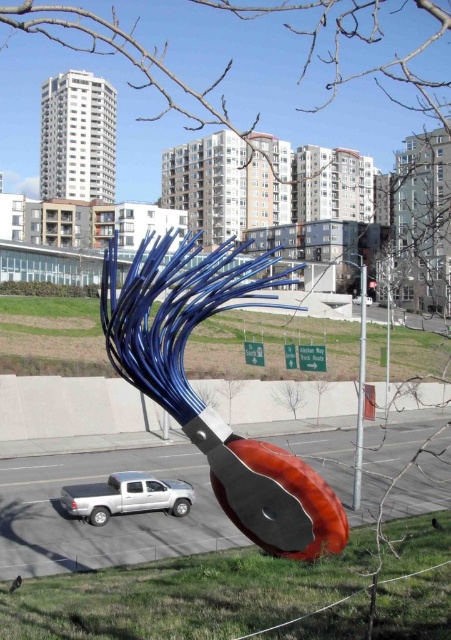
Which is below, silver metallic truck at lower left or white glossy car at center?

silver metallic truck at lower left is below.

Is silver metallic truck at lower left above white glossy car at center?

Actually, silver metallic truck at lower left is below white glossy car at center.

Describe the element at coordinates (127, 497) in the screenshot. I see `silver metallic truck at lower left` at that location.

Locate an element on the screen. Image resolution: width=451 pixels, height=640 pixels. silver metallic truck at lower left is located at coordinates (127, 497).

Does point (294, 515) lie behind point (371, 304)?

No, it is not.

Does point (236, 449) come closer to viewer compared to point (355, 304)?

Yes.

Is point (175, 285) closer to viewer compared to point (353, 300)?

Yes.

The width and height of the screenshot is (451, 640). What are the coordinates of `shiny metallic sculpture at center` in the screenshot? It's located at (203, 403).

Is metallic silver pole at center closer to the viewer compared to white glossy car at center?

Yes, it is.

Does metallic silver pole at center have a lesser height compared to white glossy car at center?

No, metallic silver pole at center is not shorter than white glossy car at center.

At what (x,y) coordinates should I click in order to perform the action: click on metallic silver pole at center. Please return your answer as a coordinate pair (x, y). This screenshot has width=451, height=640. Looking at the image, I should click on (359, 390).